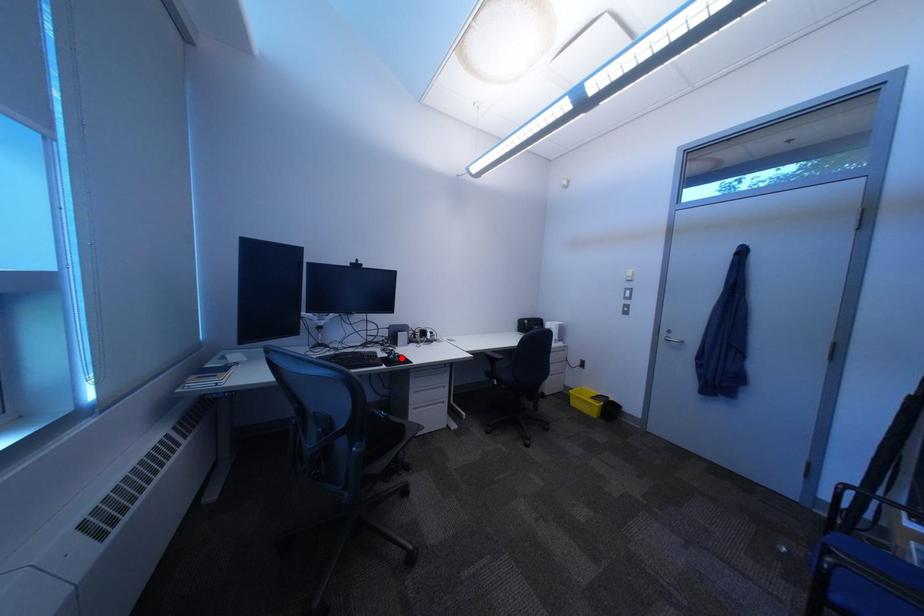
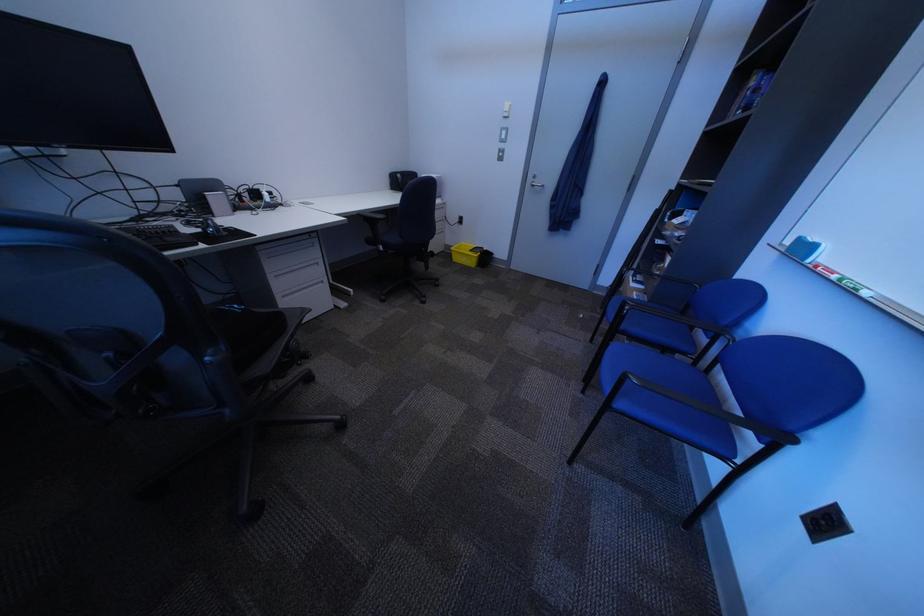
Find the pixel in the second image that matches the highlighted location in the first image.

(214, 232)